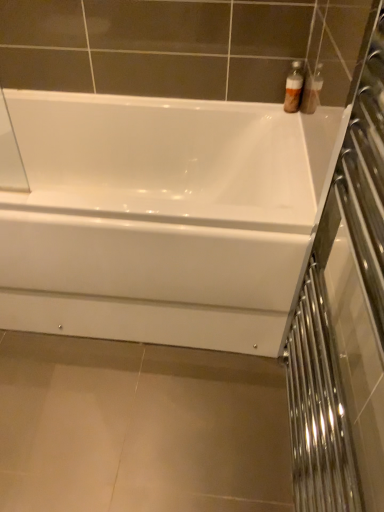
Question: From a real-world perspective, is clear glass screen door at right below translucent plastic bottles at upper right?

Choices:
 (A) yes
 (B) no

Answer: (B)

Question: Can you confirm if clear glass screen door at right is wider than translucent plastic bottles at upper right?

Choices:
 (A) yes
 (B) no

Answer: (A)

Question: Is clear glass screen door at right positioned behind translucent plastic bottles at upper right?

Choices:
 (A) yes
 (B) no

Answer: (B)

Question: Is there a large distance between clear glass screen door at right and translucent plastic bottles at upper right?

Choices:
 (A) no
 (B) yes

Answer: (A)

Question: Considering the relative sizes of clear glass screen door at right and translucent plastic bottles at upper right in the image provided, is clear glass screen door at right taller than translucent plastic bottles at upper right?

Choices:
 (A) yes
 (B) no

Answer: (A)

Question: Is clear glass screen door at right bigger or smaller than translucent plastic bottles at upper right?

Choices:
 (A) small
 (B) big

Answer: (B)

Question: Is clear glass screen door at right taller or shorter than translucent plastic bottles at upper right?

Choices:
 (A) tall
 (B) short

Answer: (A)

Question: Is clear glass screen door at right inside or outside of translucent plastic bottles at upper right?

Choices:
 (A) outside
 (B) inside

Answer: (A)

Question: In terms of width, does clear glass screen door at right look wider or thinner when compared to translucent plastic bottles at upper right?

Choices:
 (A) wide
 (B) thin

Answer: (A)

Question: Is translucent plastic bottles at upper right to the left or to the right of clear glass screen door at right in the image?

Choices:
 (A) left
 (B) right

Answer: (B)

Question: Choose the correct answer: Is translucent plastic bottles at upper right inside clear glass screen door at right or outside it?

Choices:
 (A) outside
 (B) inside

Answer: (A)

Question: Is translucent plastic bottles at upper right taller or shorter than clear glass screen door at right?

Choices:
 (A) tall
 (B) short

Answer: (B)

Question: In the image, is translucent plastic bottles at upper right positioned in front of or behind clear glass screen door at right?

Choices:
 (A) front
 (B) behind

Answer: (B)

Question: Is point (297, 76) closer or farther from the camera than point (125, 126)?

Choices:
 (A) farther
 (B) closer

Answer: (B)

Question: In terms of height, does translucent plastic bottles at upper right look taller or shorter compared to white glossy bathtub at center?

Choices:
 (A) short
 (B) tall

Answer: (A)